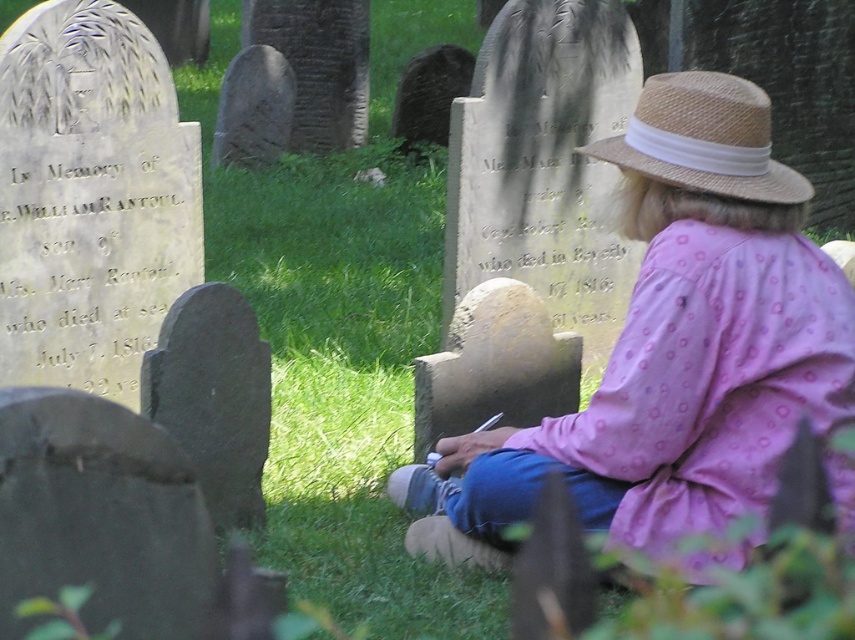
Question: Which of the following is the closest to the observer?

Choices:
 (A) straw hat at upper right
 (B) pink dotted shirt at center

Answer: (B)

Question: Which point is closer to the camera?

Choices:
 (A) pink dotted shirt at center
 (B) straw hat at upper right

Answer: (A)

Question: Does pink dotted shirt at center lie behind straw hat at upper right?

Choices:
 (A) yes
 (B) no

Answer: (B)

Question: Is pink dotted shirt at center to the right of straw hat at upper right from the viewer's perspective?

Choices:
 (A) no
 (B) yes

Answer: (A)

Question: Does pink dotted shirt at center appear on the right side of straw hat at upper right?

Choices:
 (A) no
 (B) yes

Answer: (A)

Question: Which object appears farthest from the camera in this image?

Choices:
 (A) straw hat at upper right
 (B) pink dotted shirt at center

Answer: (A)